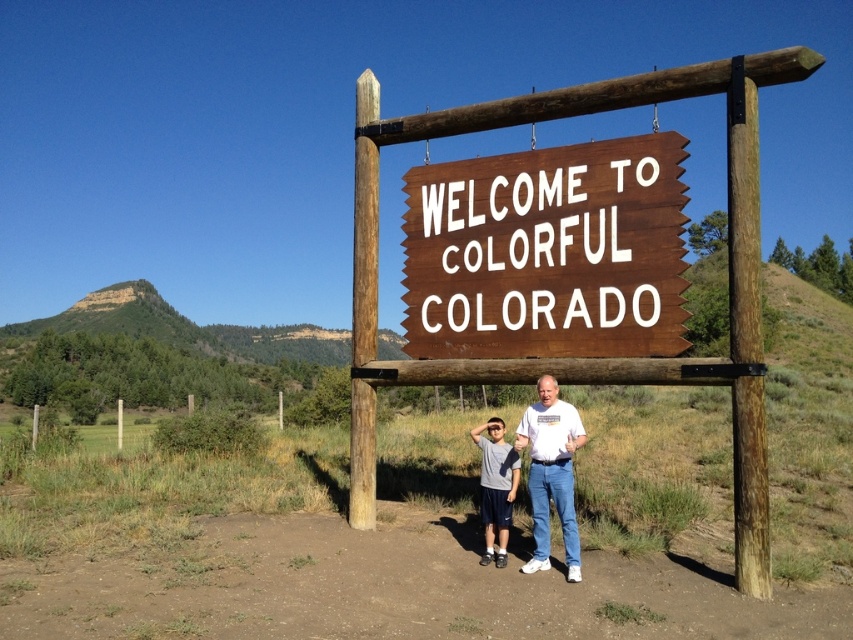
Is white t-shirt at center further to camera compared to matte gray t-shirt at center?

No, it is not.

Between point (556, 436) and point (498, 474), which one is positioned in front?

Positioned in front is point (556, 436).

Where is `white t-shirt at center`? white t-shirt at center is located at coordinates (550, 472).

Who is taller, wooden sign at center or matte gray t-shirt at center?

wooden sign at center is taller.

Does point (582, 244) lie in front of point (502, 465)?

No, it is not.

I want to click on wooden sign at center, so click(548, 252).

This screenshot has height=640, width=853. What do you see at coordinates (548, 252) in the screenshot?
I see `wooden sign at center` at bounding box center [548, 252].

Who is positioned more to the right, wooden sign at center or white t-shirt at center?

Positioned to the right is white t-shirt at center.

The width and height of the screenshot is (853, 640). In order to click on wooden sign at center in this screenshot , I will do `click(548, 252)`.